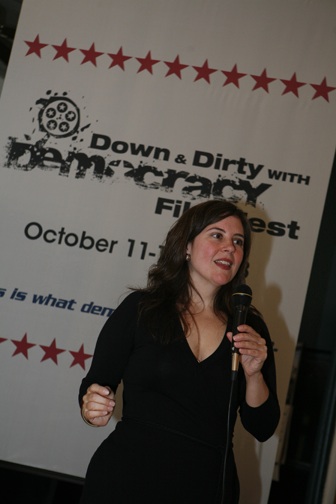
Where is `cable`? This screenshot has width=336, height=504. cable is located at coordinates (228, 444).